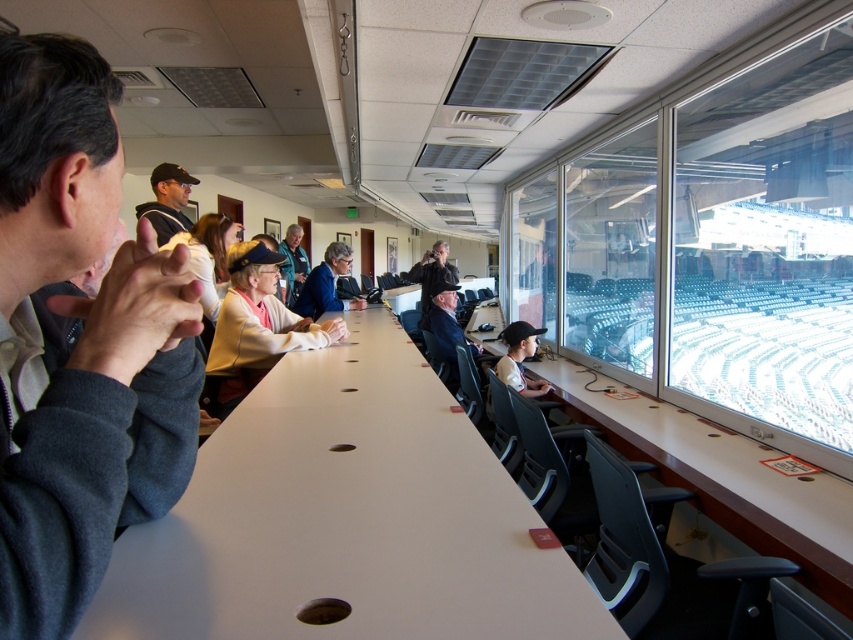
Question: Does matte blue jacket at center appear under light brown leather jacket at center?

Choices:
 (A) no
 (B) yes

Answer: (B)

Question: Which object appears closest to the camera in this image?

Choices:
 (A) white matte table at center
 (B) light brown leather jacket at center
 (C) matte black cap at upper center

Answer: (A)

Question: Which point is closer to the camera taking this photo?

Choices:
 (A) (323, 273)
 (B) (703, 518)

Answer: (B)

Question: Is matte black cap at upper center bigger than matte blue jacket at center?

Choices:
 (A) yes
 (B) no

Answer: (B)

Question: Is gray fleece jacket at left to the right of matte blue jacket at center from the viewer's perspective?

Choices:
 (A) no
 (B) yes

Answer: (B)

Question: Which of these objects is positioned farthest from the light brown leather jacket at center?

Choices:
 (A) white laminate table at right
 (B) white matte table at center
 (C) white fabric jacket at center

Answer: (B)